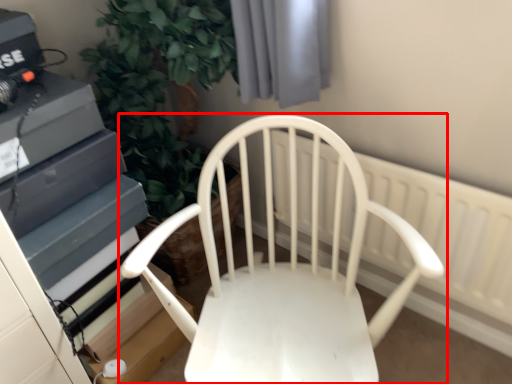
Question: From the image's perspective, where is chair (annotated by the red box) located relative to radiator?

Choices:
 (A) above
 (B) below

Answer: (B)